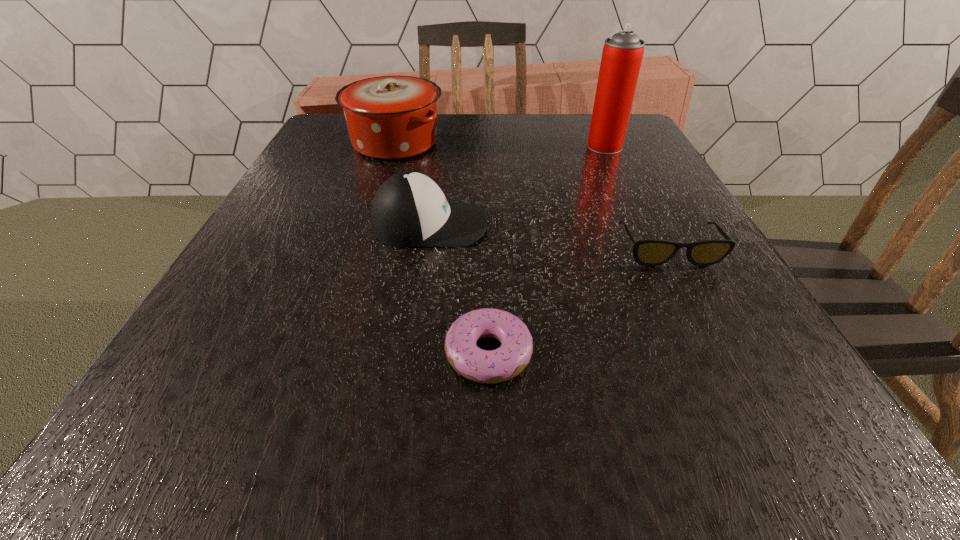
The image size is (960, 540). I want to click on vacant region located 0.140m on the right of the nearest object, so pyautogui.click(x=635, y=352).

Locate an element on the screen. The image size is (960, 540). aerosol can positioned at the far edge is located at coordinates click(622, 55).

You are a GUI agent. You are given a task and a screenshot of the screen. Output one action in this format:
    pyautogui.click(x=<x>, y=<y>)
    Task: Click on the casserole present at the far edge
    
    Given the screenshot: What is the action you would take?
    pyautogui.click(x=388, y=118)

Identify the location of object that is at the left edge. The width and height of the screenshot is (960, 540). (388, 118).

Where is `aerosol can at the right edge`? aerosol can at the right edge is located at coordinates (622, 55).

The height and width of the screenshot is (540, 960). In order to click on sunglasses that is positioned at the right edge in this screenshot , I will do `click(651, 252)`.

The width and height of the screenshot is (960, 540). I want to click on object that is at the far left corner, so (388, 118).

This screenshot has height=540, width=960. Identify the location of object situated at the far right corner. (622, 55).

In the image, there is a desktop. Where is `blank space at the far edge`? This screenshot has width=960, height=540. blank space at the far edge is located at coordinates (540, 142).

At what (x,y) coordinates should I click in order to perform the action: click on free space at the left edge. Please return your answer as a coordinate pair (x, y). Looking at the image, I should click on (241, 292).